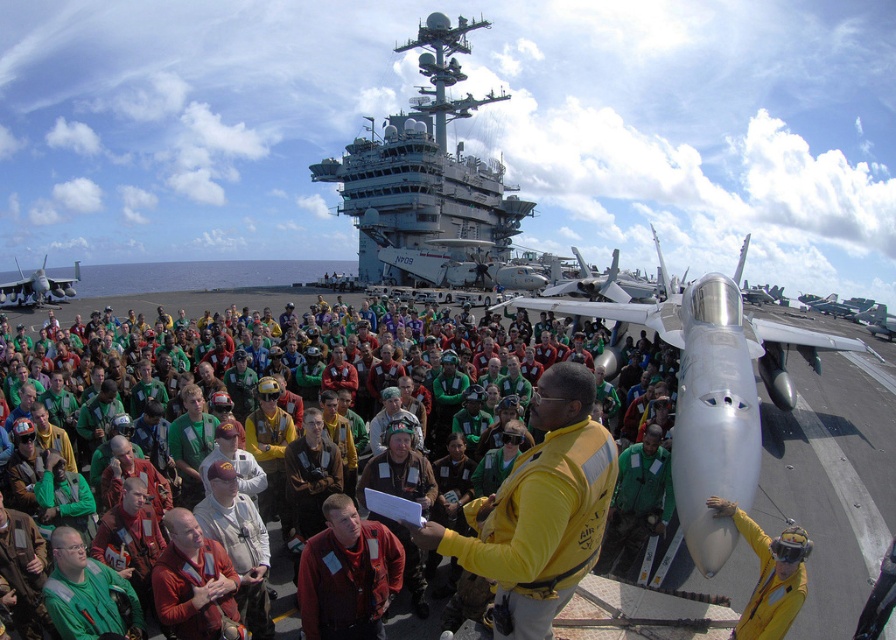
What do you see at coordinates (239, 545) in the screenshot? I see `white fabric shirt at center` at bounding box center [239, 545].

Which is behind, point (227, 468) or point (58, 291)?

Point (58, 291)

Does point (216, 531) come farther from viewer compared to point (42, 262)?

No, it is in front of (42, 262).

I want to click on white fabric shirt at center, so click(239, 545).

Which of these two, brown leather jacket at center or silver metallic jet at left, stands taller?

With more height is silver metallic jet at left.

What do you see at coordinates (192, 580) in the screenshot? I see `brown leather jacket at center` at bounding box center [192, 580].

What are the coordinates of `brown leather jacket at center` in the screenshot? It's located at (192, 580).

Identify the location of brown leather jacket at center. (192, 580).

Which is above, silver metallic jet at center or white fabric shirt at center?

silver metallic jet at center is higher up.

Does silver metallic jet at center have a greater height compared to white fabric shirt at center?

Correct, silver metallic jet at center is much taller as white fabric shirt at center.

Is point (701, 422) positioned in front of point (246, 548)?

No, (701, 422) is further to viewer.

Where is `silver metallic jet at center`? The width and height of the screenshot is (896, 640). silver metallic jet at center is located at coordinates click(712, 390).